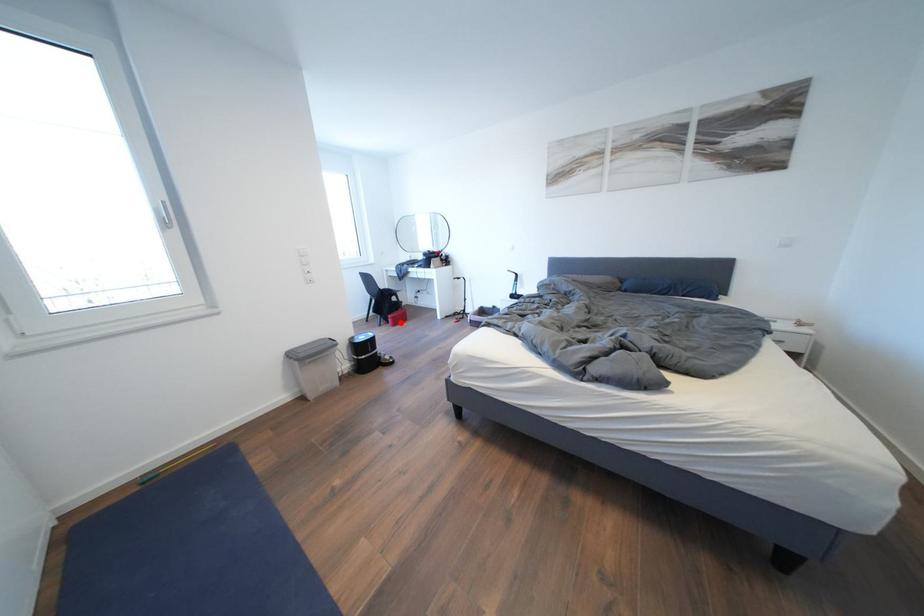
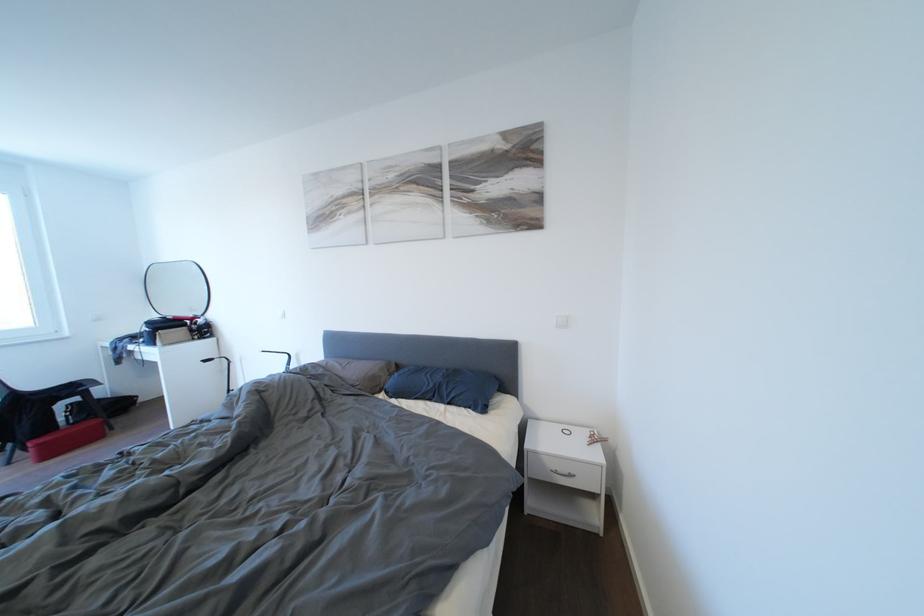
Question: I am providing you with two images of the same scene from different viewpoints. In image1, a red point is highlighted. Considering the same 3D point in image2, which of the following is correct?

Choices:
 (A) It is closer
 (B) It is farther

Answer: (A)